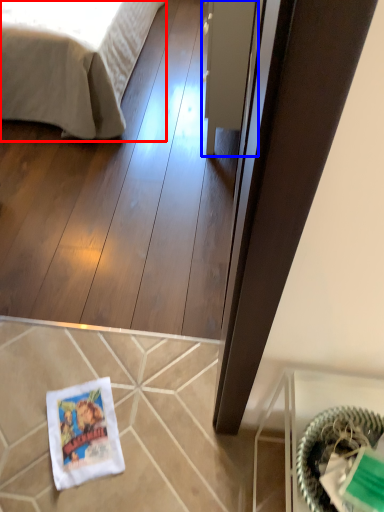
Question: Which object appears closest to the camera in this image, bed (highlighted by a red box) or glass door (highlighted by a blue box)?

Choices:
 (A) bed
 (B) glass door

Answer: (B)